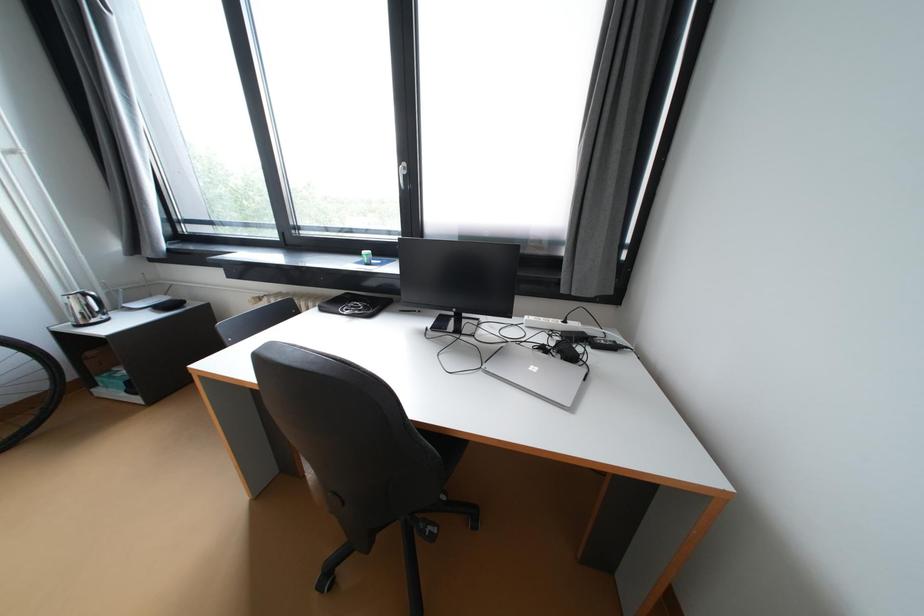
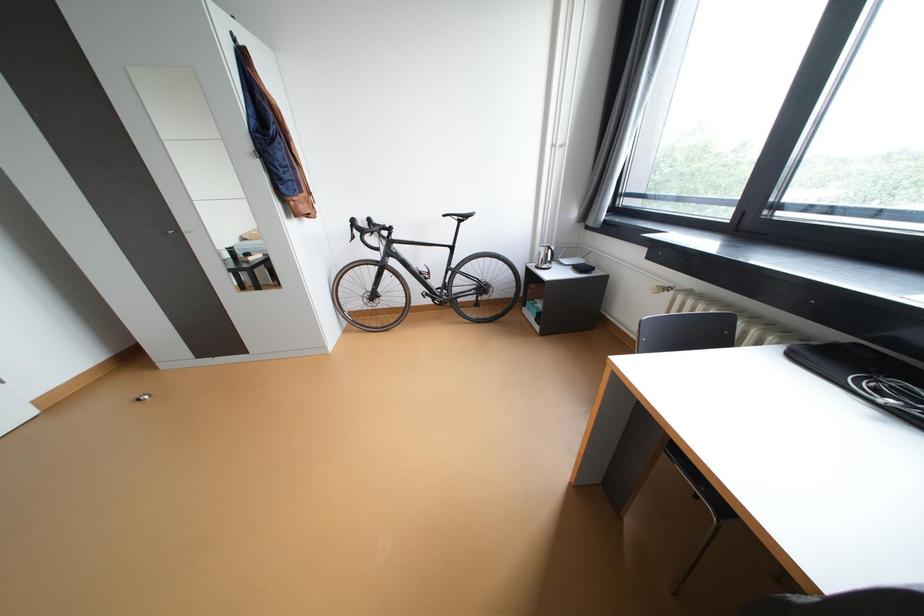
How did the camera likely rotate?

The camera rotated toward left-down.